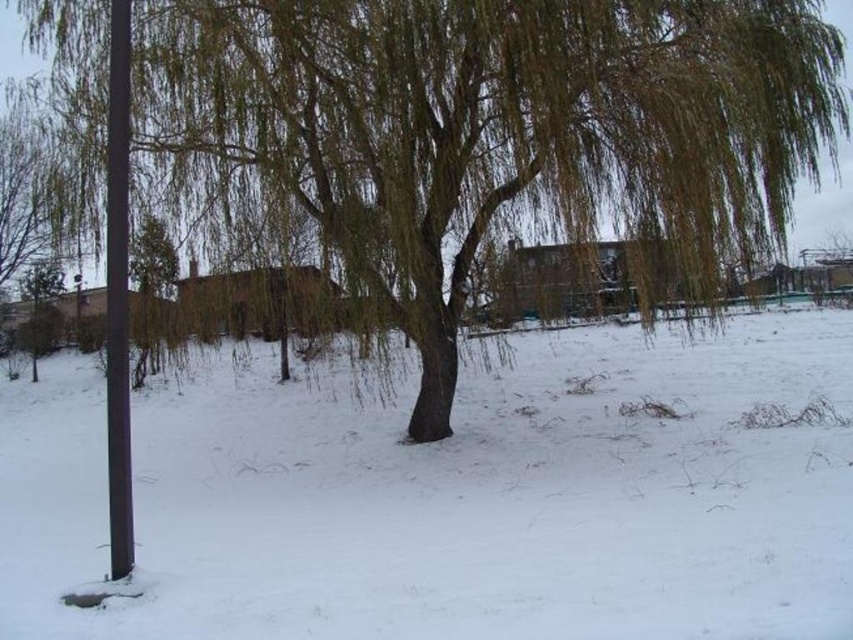
Is white fluffy snow at lower left to the left of green leafy tree at center from the viewer's perspective?

In fact, white fluffy snow at lower left is to the right of green leafy tree at center.

Does point (706, 456) come farther from viewer compared to point (132, 272)?

No, it is not.

I want to click on white fluffy snow at lower left, so click(x=453, y=499).

Does white fluffy snow at lower left have a smaller size compared to smooth black pole at left?

Actually, white fluffy snow at lower left might be larger than smooth black pole at left.

Where is `white fluffy snow at lower left`? Image resolution: width=853 pixels, height=640 pixels. white fluffy snow at lower left is located at coordinates pos(453,499).

Describe the element at coordinates (453, 499) in the screenshot. I see `white fluffy snow at lower left` at that location.

Find the location of a particular element. This screenshot has width=853, height=640. white fluffy snow at lower left is located at coordinates (453, 499).

Consider the image. Who is more distant from viewer, (289,106) or (111,429)?

Point (289,106)

Who is shorter, brown textured willow at center or smooth black pole at left?

smooth black pole at left is shorter.

Looking at this image, who is more distant from viewer, (91, 60) or (115, 68)?

Positioned behind is point (91, 60).

Locate an element on the screen. brown textured willow at center is located at coordinates (492, 124).